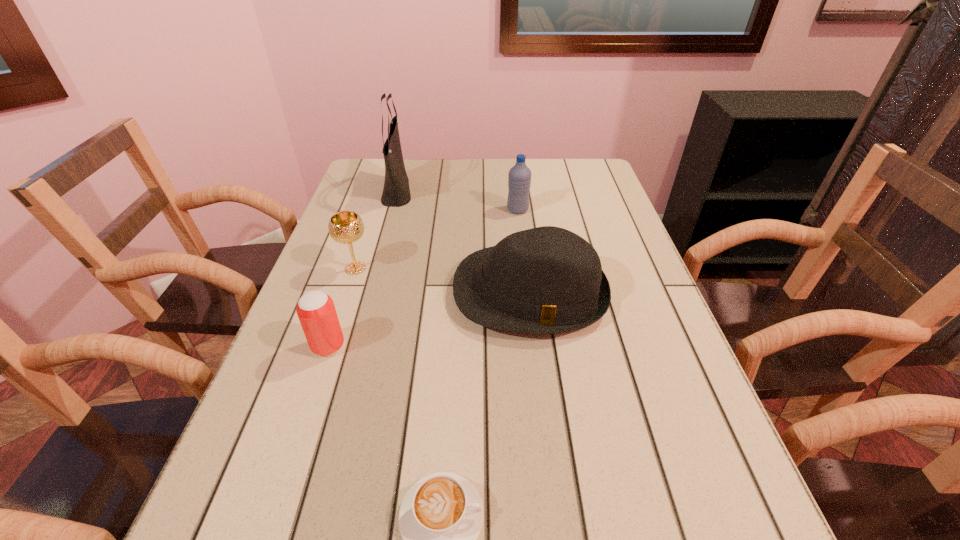
At what (x,y) coordinates should I click in order to perform the action: click on empty location between the chalice and the fedora. Please return your answer as a coordinate pair (x, y). The image size is (960, 540). Looking at the image, I should click on (443, 281).

In order to click on vacant area that lies between the chalice and the tallest object in this screenshot , I will do `click(377, 230)`.

I want to click on free spot between the beer can and the chalice, so click(x=342, y=307).

At what (x,y) coordinates should I click in order to perform the action: click on free space between the chalice and the shoulder bag. Please return your answer as a coordinate pair (x, y). Image resolution: width=960 pixels, height=540 pixels. Looking at the image, I should click on (377, 230).

The image size is (960, 540). Find the location of `free space between the water bottle and the beer can`. free space between the water bottle and the beer can is located at coordinates (423, 278).

Identify the location of vacant space that is in between the fedora and the shoulder bag. (464, 242).

At what (x,y) coordinates should I click in order to perform the action: click on vacant region between the water bottle and the chalice. Please return your answer as a coordinate pair (x, y). Image resolution: width=960 pixels, height=540 pixels. Looking at the image, I should click on (437, 239).

Identify which object is the second nearest to the shortest object. Please provide its 2D coordinates. Your answer should be formatted as a tuple, i.e. [(x, y)], where the tuple contains the x and y coordinates of a point satisfying the conditions above.

[(316, 311)]

This screenshot has height=540, width=960. I want to click on object that is the fifth closest to the fedora, so click(441, 515).